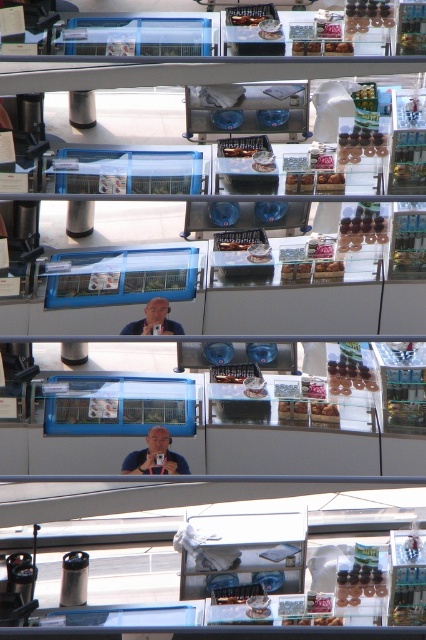
Question: Is smooth skin selfie at center thinner than matte blue shirt at center?

Choices:
 (A) no
 (B) yes

Answer: (A)

Question: Can you confirm if smooth skin selfie at center is smaller than matte blue shirt at center?

Choices:
 (A) yes
 (B) no

Answer: (B)

Question: Does smooth skin selfie at center appear over matte blue shirt at center?

Choices:
 (A) no
 (B) yes

Answer: (A)

Question: Which of the following is the farthest from the observer?

Choices:
 (A) (154, 304)
 (B) (143, 468)

Answer: (A)